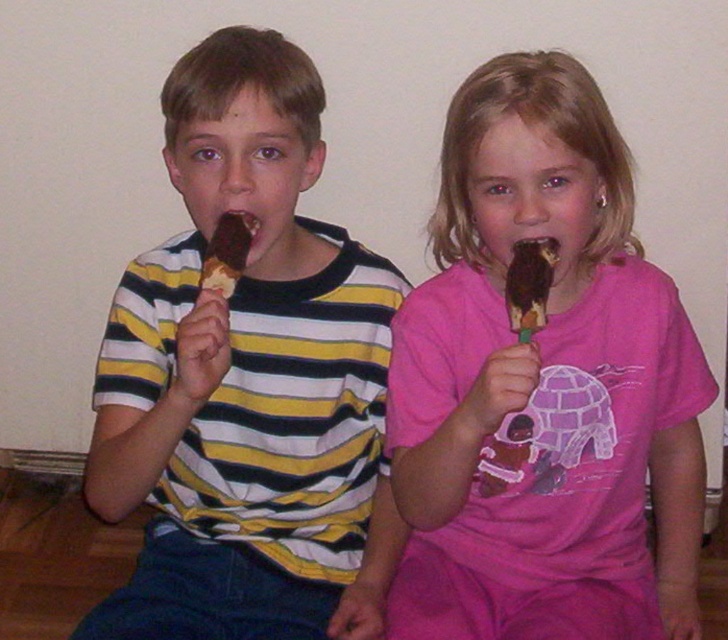
The width and height of the screenshot is (728, 640). Find the location of `matte chocolate ice cream bar at center`. matte chocolate ice cream bar at center is located at coordinates (248, 380).

Does matte chocolate ice cream bar at center have a lesser width compared to chocolate coated ice cream at upper center?

No, matte chocolate ice cream bar at center is not thinner than chocolate coated ice cream at upper center.

Which is in front, point (217, 113) or point (513, 268)?

Point (217, 113) is more forward.

The image size is (728, 640). What are the coordinates of `matte chocolate ice cream bar at center` in the screenshot? It's located at (248, 380).

Does point (513, 262) come in front of point (256, 228)?

Yes, point (513, 262) is in front of point (256, 228).

Does chocolate coated ice cream at upper center have a greater height compared to chocolate ice cream at center?

Correct, chocolate coated ice cream at upper center is much taller as chocolate ice cream at center.

Measure the distance between chocolate coated ice cream at upper center and camera.

A distance of 1.09 meters exists between chocolate coated ice cream at upper center and camera.

At what (x,y) coordinates should I click in order to perform the action: click on chocolate coated ice cream at upper center. Please return your answer as a coordinate pair (x, y). Looking at the image, I should click on (529, 284).

Does pink matte ice cream at center come in front of chocolate coated ice cream at upper center?

Yes, pink matte ice cream at center is in front of chocolate coated ice cream at upper center.

Is pink matte ice cream at center further to camera compared to chocolate coated ice cream at upper center?

No, it is in front of chocolate coated ice cream at upper center.

Does point (574, 444) come in front of point (531, 321)?

No, (574, 444) is behind (531, 321).

The height and width of the screenshot is (640, 728). Find the location of `pink matte ice cream at center`. pink matte ice cream at center is located at coordinates (542, 387).